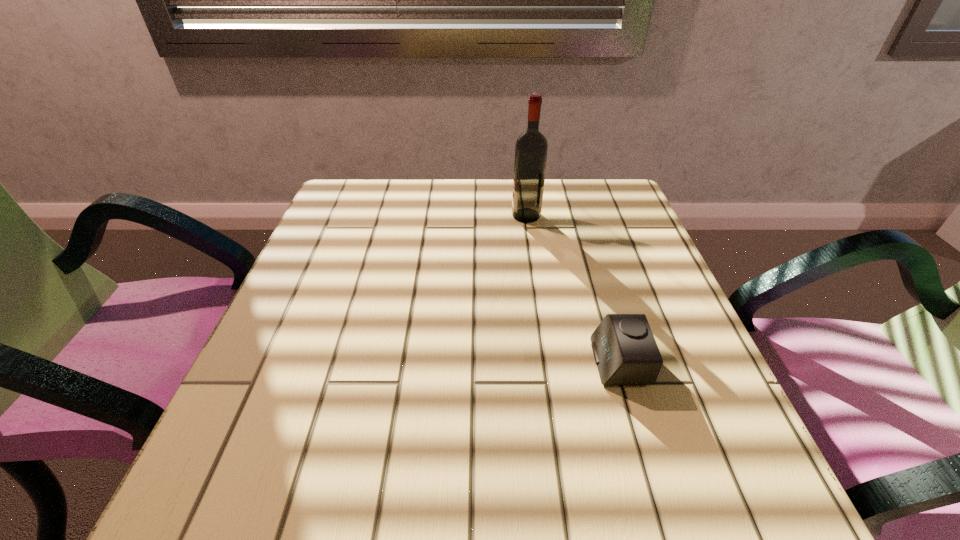
This screenshot has height=540, width=960. I want to click on object that is at the far edge, so click(531, 148).

Locate an element on the screen. The width and height of the screenshot is (960, 540). object located at the right edge is located at coordinates (625, 351).

Find the location of a particular element. The height and width of the screenshot is (540, 960). blank space at the far edge is located at coordinates (453, 212).

Identify the location of blank space at the near edge of the desktop. The width and height of the screenshot is (960, 540). (639, 517).

At what (x,y) coordinates should I click in order to perform the action: click on vacant region at the left edge of the desktop. Please return your answer as a coordinate pair (x, y). Looking at the image, I should click on (301, 417).

This screenshot has height=540, width=960. In order to click on free region at the right edge in this screenshot , I will do `click(624, 240)`.

This screenshot has height=540, width=960. What are the coordinates of `vacant space at the far left corner` in the screenshot? It's located at (367, 182).

Where is `free space at the near left corner of the desktop`? This screenshot has height=540, width=960. free space at the near left corner of the desktop is located at coordinates (264, 501).

Locate an element on the screen. Image resolution: width=960 pixels, height=540 pixels. free location at the far right corner is located at coordinates (562, 184).

Locate an element on the screen. The height and width of the screenshot is (540, 960). vacant space at the near right corner of the desktop is located at coordinates (765, 509).